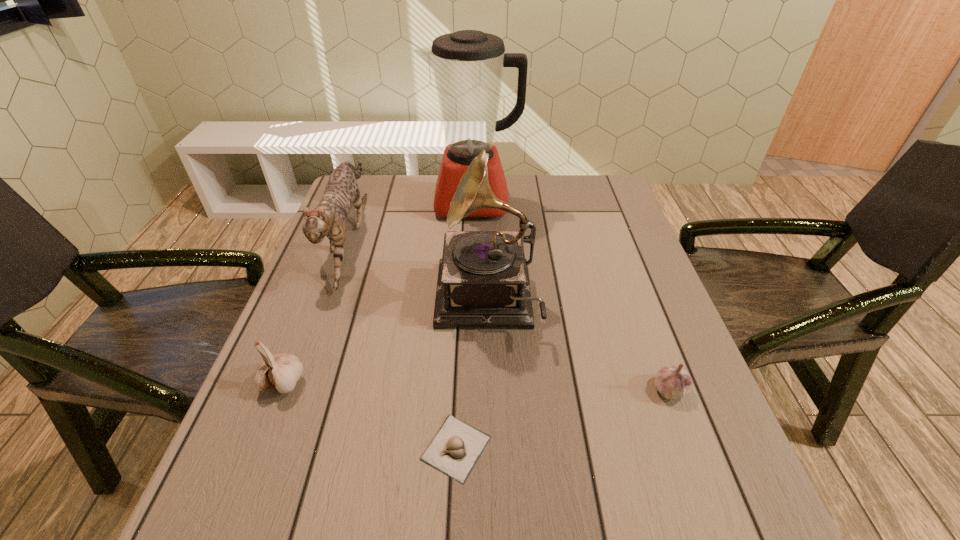
Identify the location of the tallest object. The width and height of the screenshot is (960, 540). (468, 65).

At what (x,y) coordinates should I click in order to perform the action: click on the second tallest object. Please return your answer as a coordinate pair (x, y). Image resolution: width=960 pixels, height=540 pixels. Looking at the image, I should click on (483, 281).

This screenshot has width=960, height=540. I want to click on the fourth shortest object, so 328,219.

You are a GUI agent. You are given a task and a screenshot of the screen. Output one action in this format:
    pyautogui.click(x=<x>, y=<y>)
    Task: Click on the fourth tallest object
    The height and width of the screenshot is (540, 960).
    Given the screenshot: What is the action you would take?
    pyautogui.click(x=281, y=371)

The width and height of the screenshot is (960, 540). I want to click on the leftmost garlic, so click(281, 371).

Identify the location of the fifth tallest object. (673, 382).

I want to click on the rightmost garlic, so pos(673,382).

Where is `the nearest garlic`? The width and height of the screenshot is (960, 540). the nearest garlic is located at coordinates (455, 449).

This screenshot has width=960, height=540. In order to click on the shortest object in this screenshot , I will do (x=455, y=449).

I want to click on free spot located 0.120m on the front of the tallest object near the controls, so click(x=472, y=249).